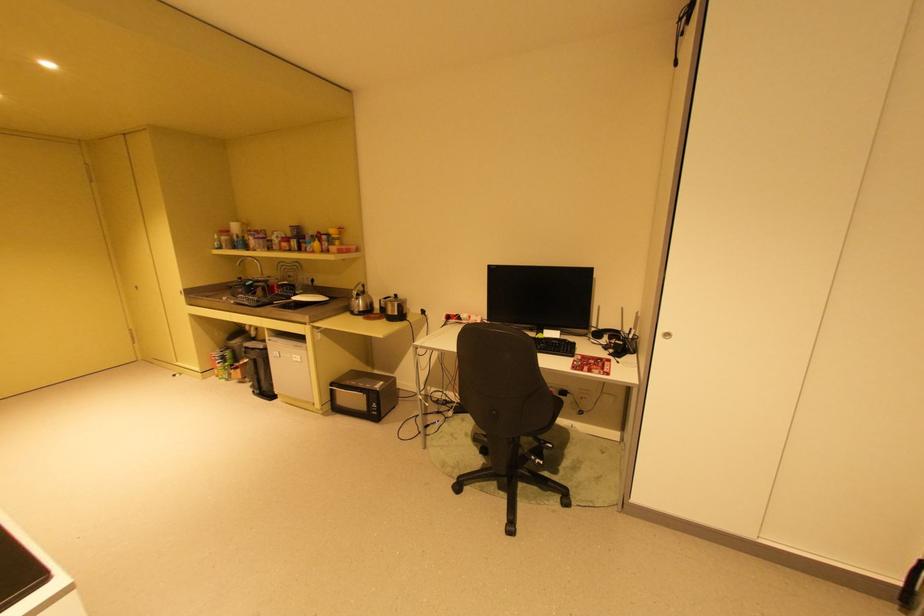
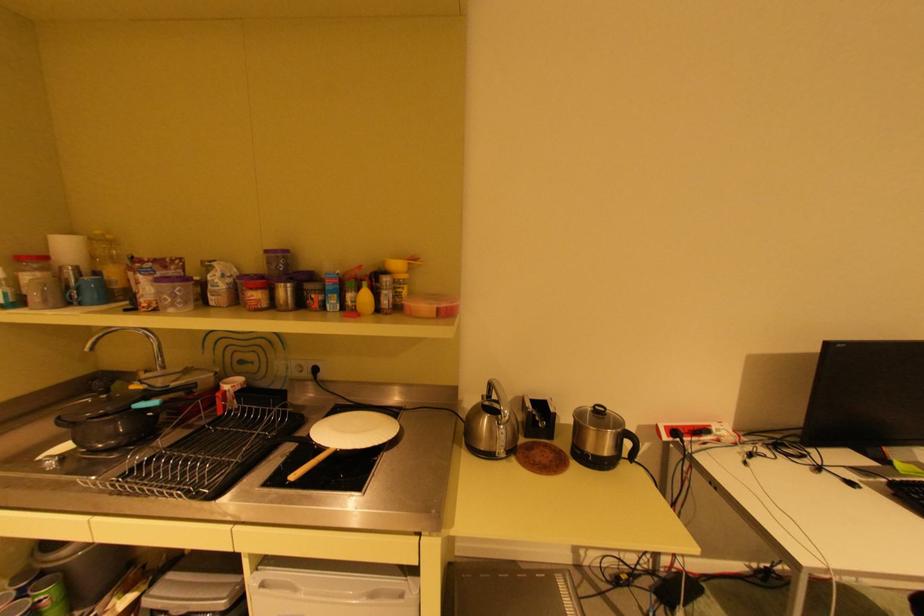
The point at (292,245) is marked in the first image. Where is the corresponding point in the second image?

(264, 294)